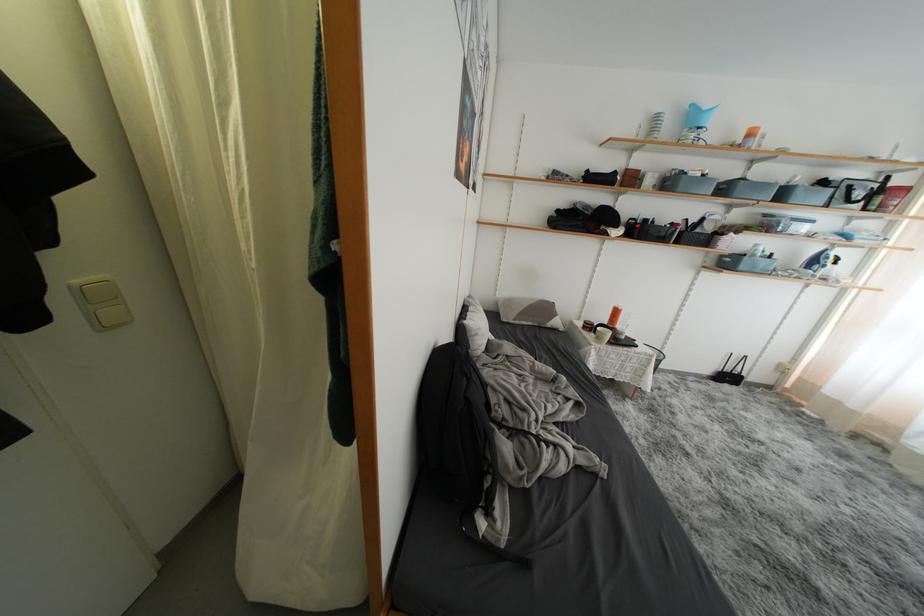
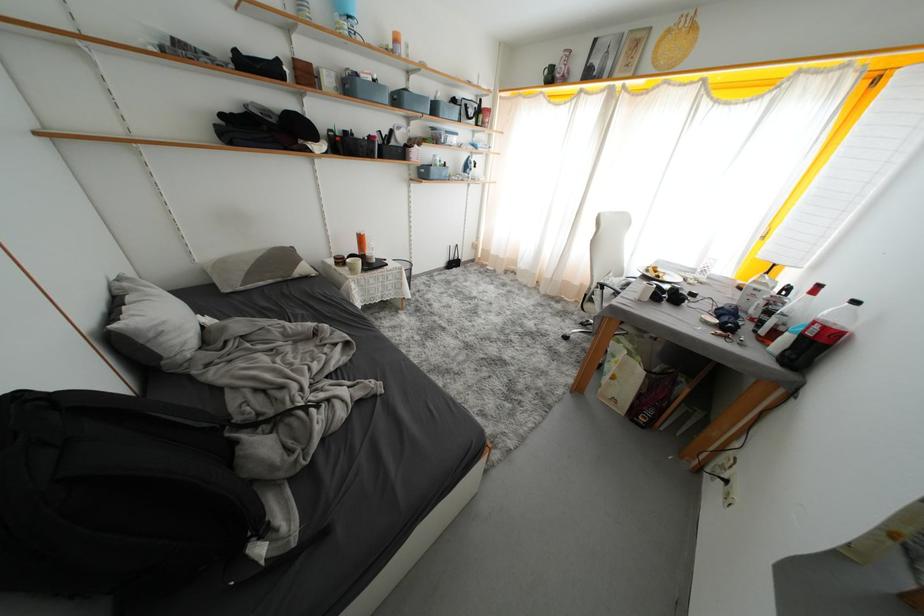
The first image is from the beginning of the video and the second image is from the end. How did the camera likely rotate when shooting the video?

The rotation direction of the camera is right-down.